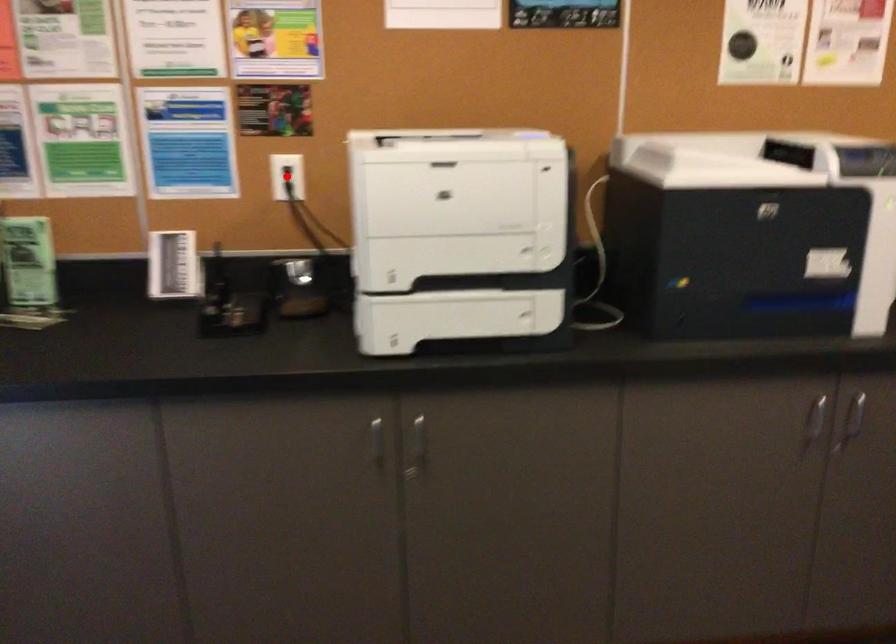
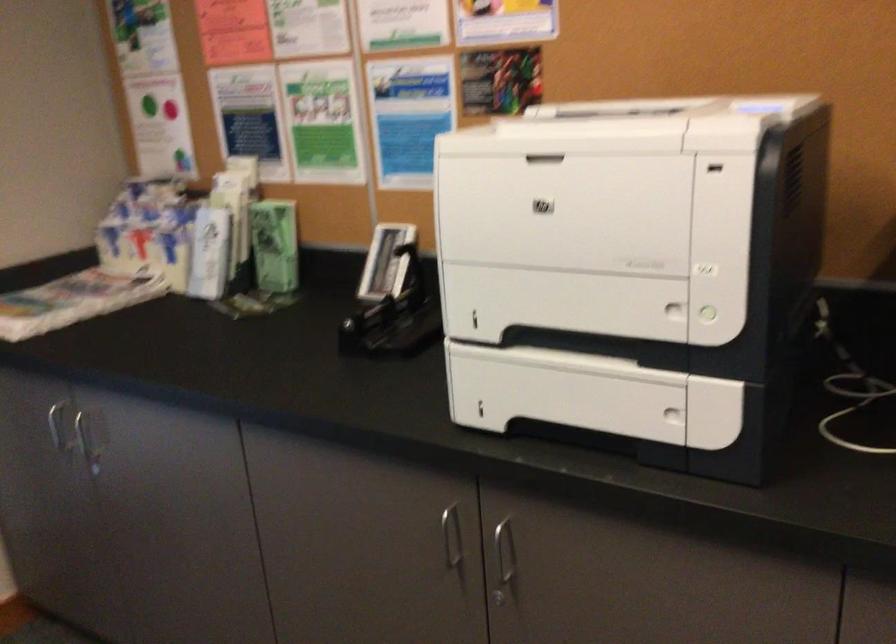
Question: I am providing you with two images of the same scene from different viewpoints. A red point is marked on the first image. Is the red point's position out of view in image 2?

Choices:
 (A) Yes
 (B) No

Answer: (A)